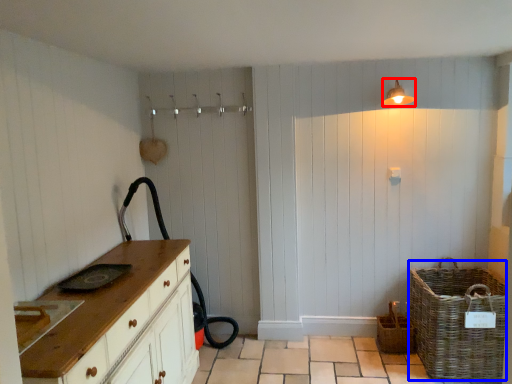
Question: Among these objects, which one is farthest to the camera, light fixture (highlighted by a red box) or basket (highlighted by a blue box)?

Choices:
 (A) light fixture
 (B) basket

Answer: (A)